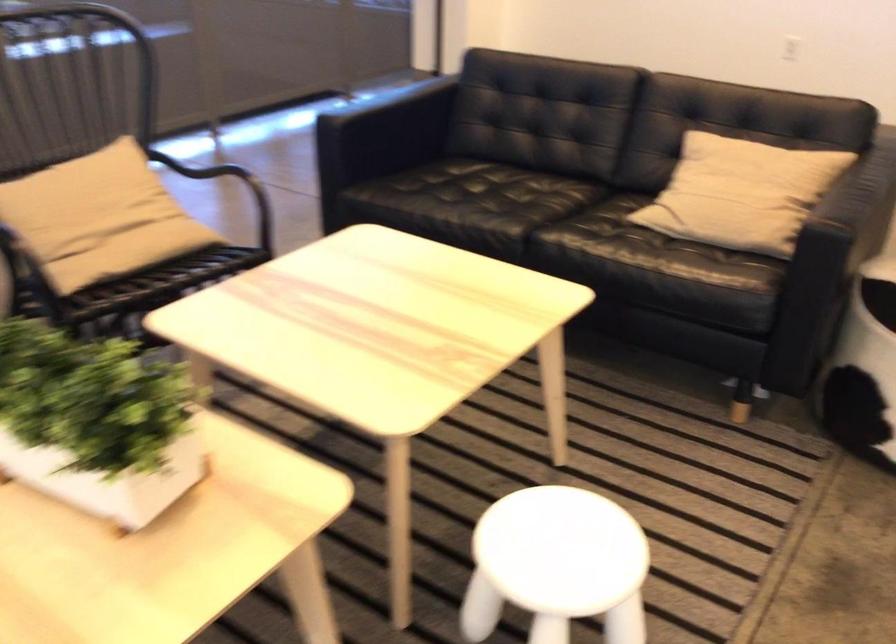
Describe the element at coordinates (376, 98) in the screenshot. I see `a sofa armrest` at that location.